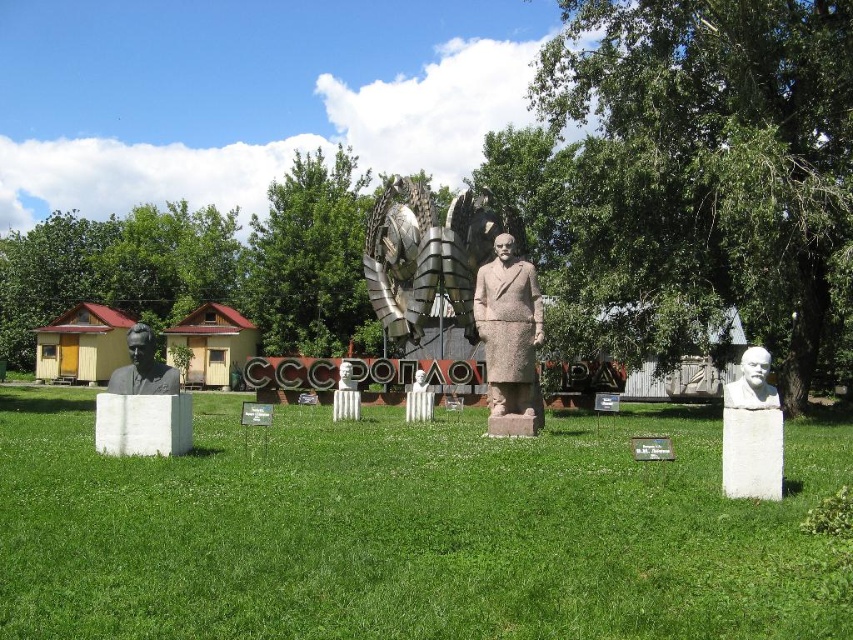
Question: Is green grass at center thinner than white marble bust at center?

Choices:
 (A) no
 (B) yes

Answer: (A)

Question: Is green grass at center to the left of white marble bust at center from the viewer's perspective?

Choices:
 (A) yes
 (B) no

Answer: (A)

Question: Which object is farther from the camera taking this photo?

Choices:
 (A) green grass at center
 (B) white marble bust at center
 (C) white marble bust at left

Answer: (C)

Question: Which of the following is the farthest from the observer?

Choices:
 (A) (256, 605)
 (B) (128, 371)
 (C) (509, 349)
 (D) (734, 387)

Answer: (C)

Question: Does gray stone statue at center appear over white marble bust at center?

Choices:
 (A) no
 (B) yes

Answer: (B)

Question: Which of the following is the farthest from the observer?

Choices:
 (A) white marble bust at center
 (B) gray stone statue at center
 (C) green grass at center

Answer: (B)